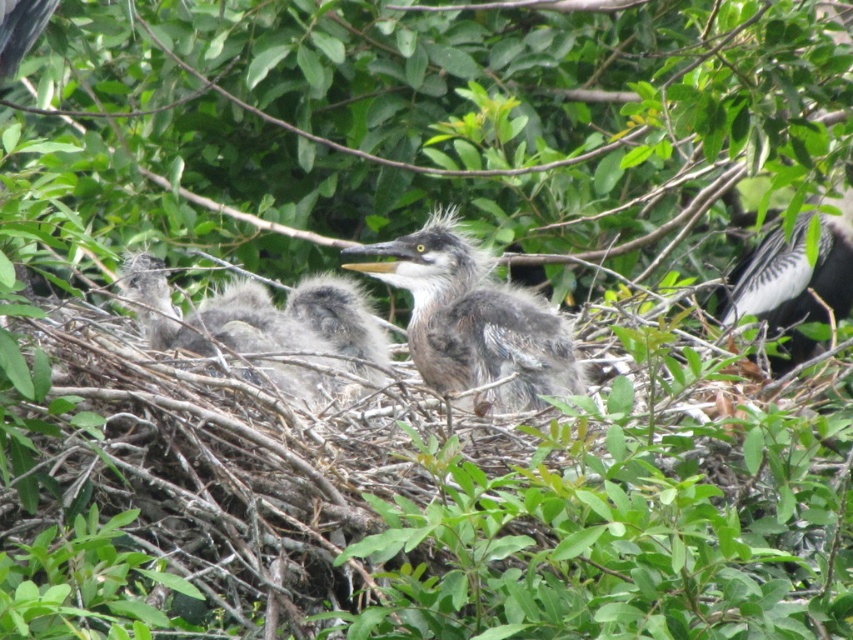
Between gray fluffy bird at center and gray fluffy nestling at center, which one is positioned lower?

gray fluffy bird at center is lower down.

Is point (440, 275) positioned after point (357, 394)?

Yes, point (440, 275) is farther from viewer.

Locate an element on the screen. The width and height of the screenshot is (853, 640). gray fluffy bird at center is located at coordinates (474, 321).

Where is `gray fluffy bird at center`? This screenshot has width=853, height=640. gray fluffy bird at center is located at coordinates (x=474, y=321).

Does point (302, 328) come closer to viewer compared to point (816, 317)?

Yes, point (302, 328) is closer to viewer.

Can you confirm if gray fluffy nestling at center is shorter than gray-white feathers at right?

Yes.

The image size is (853, 640). I want to click on gray fluffy nestling at center, so click(x=267, y=332).

What are the coordinates of `gray fluffy bird at center` in the screenshot? It's located at click(x=474, y=321).

Is gray fluffy bird at center further to the viewer compared to gray-white feathers at right?

No, it is in front of gray-white feathers at right.

Between point (529, 381) and point (836, 224), which one is positioned behind?

Point (836, 224)

Identify the location of gray fluffy bird at center. (474, 321).